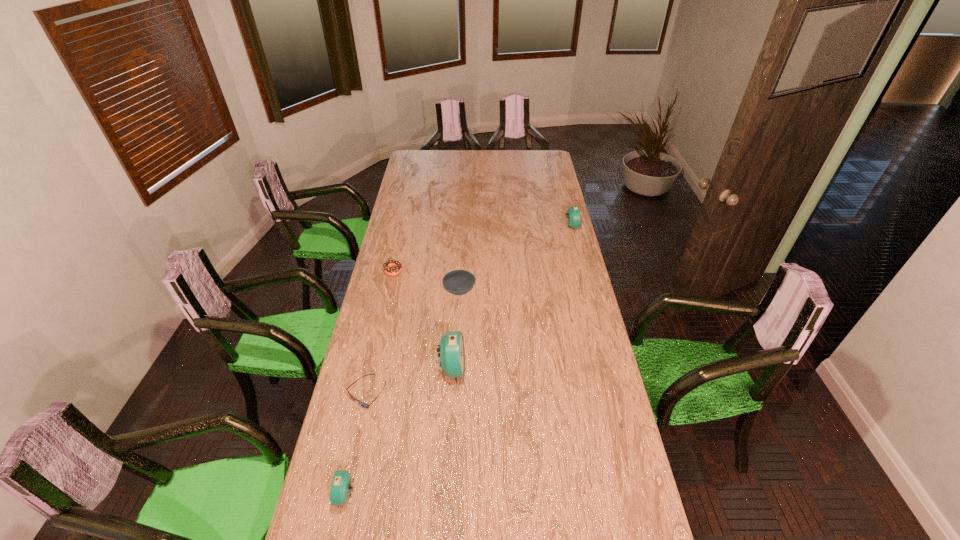
Locate an element on the screen. The width and height of the screenshot is (960, 540). object present at the near left corner is located at coordinates (341, 484).

You are a GUI agent. You are given a task and a screenshot of the screen. Output one action in this format:
    pyautogui.click(x=<x>, y=<y>)
    Task: Click on the vacant area at the far edge of the desktop
    Image resolution: width=960 pixels, height=540 pixels.
    Given the screenshot: What is the action you would take?
    pyautogui.click(x=441, y=164)

The image size is (960, 540). Find the location of `vacant space at the left edge`. vacant space at the left edge is located at coordinates (362, 335).

Locate an element on the screen. free space at the right edge of the desktop is located at coordinates (583, 461).

Where is `vacant space at the far left corner of the desktop`? vacant space at the far left corner of the desktop is located at coordinates [428, 153].

Identify the location of vacant space at the near right corner of the desktop. pyautogui.click(x=643, y=502).

Where is `empty space that is in between the sunglasses and the tallest alarm clock`? The width and height of the screenshot is (960, 540). empty space that is in between the sunglasses and the tallest alarm clock is located at coordinates (409, 381).

This screenshot has width=960, height=540. In order to click on vacant area that lies between the fifth shortest object and the sunglasses in this screenshot , I will do `click(468, 310)`.

You are a GUI agent. You are given a task and a screenshot of the screen. Output one action in this format:
    pyautogui.click(x=<x>, y=<y>)
    Task: Click on the blank region between the rightmost object and the third shortest object
    This screenshot has width=960, height=540.
    Given the screenshot: What is the action you would take?
    pyautogui.click(x=516, y=259)

Where is `free space between the tallest object and the farthest object`? The image size is (960, 540). free space between the tallest object and the farthest object is located at coordinates (512, 298).